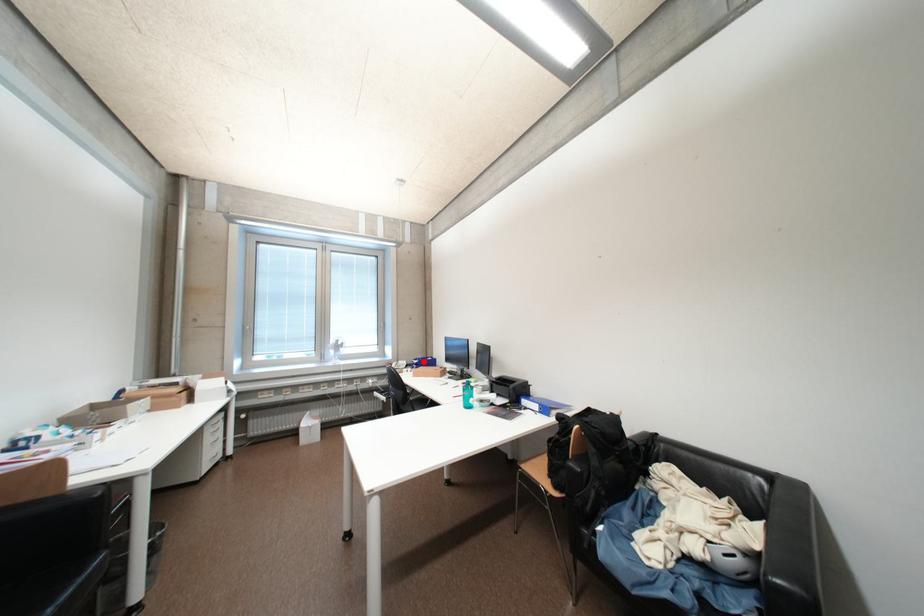
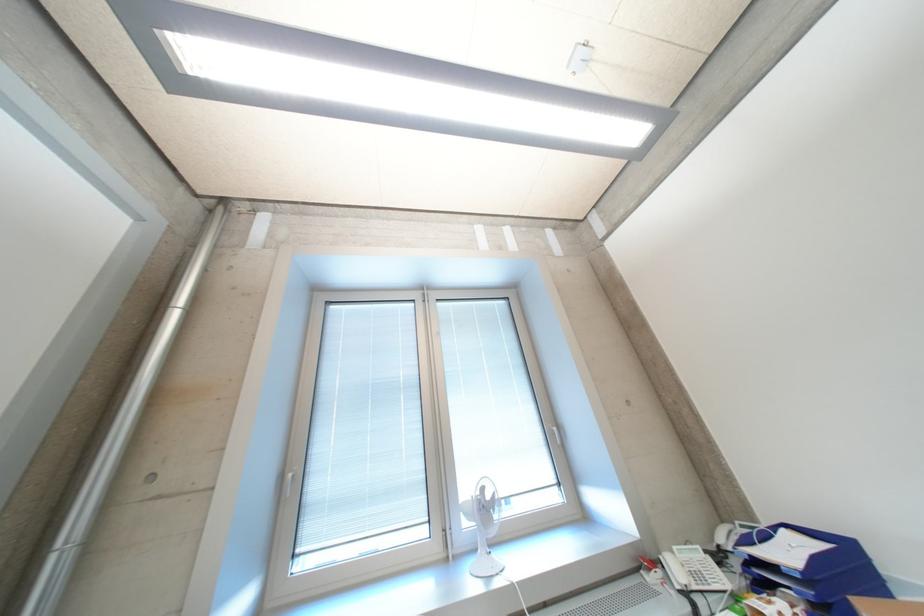
In the second image, find the point that corresponds to the highlighted location in the first image.

(757, 543)